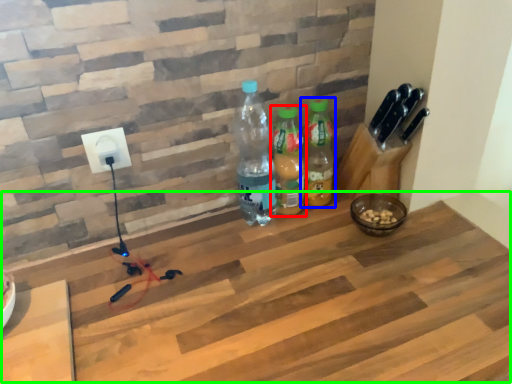
Question: Estimate the real-world distances between objects in this image. Which object is farther from bottle (highlighted by a red box), bottle (highlighted by a blue box) or workbench (highlighted by a green box)?

Choices:
 (A) bottle
 (B) workbench

Answer: (B)